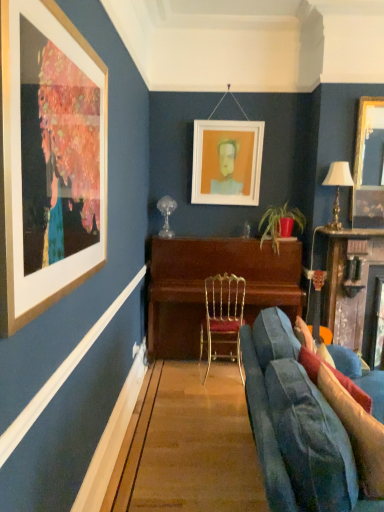
What is the approximate width of velvet blue couch at lower right?

velvet blue couch at lower right is 1.06 meters in width.

What is the approximate width of gold metallic chair at center?

16.53 inches.

Describe the element at coordinates (227, 162) in the screenshot. I see `matte white picture frame at center, the 2th picture frame from the front` at that location.

Find the location of a particular element. This screenshot has height=512, width=384. matte white picture frame at center, marked as the first picture frame in a left-to-right arrangement is located at coordinates (227, 162).

At what (x,y) coordinates should I click in order to perform the action: click on green leafy plant in red pot at center. Please return your answer as a coordinate pair (x, y). The height and width of the screenshot is (512, 384). Looking at the image, I should click on (279, 222).

The height and width of the screenshot is (512, 384). What are the coordinates of `velvet blue couch at lower right` in the screenshot? It's located at (x=295, y=426).

Is point (308, 369) farther from viewer compared to point (354, 438)?

That is True.

From their relative heights in the image, would you say velvet red pillow at lower right, which is the 1th pillow in back-to-front order, is taller or shorter than velvet blue pillow at lower right, the second pillow positioned from the back?

velvet red pillow at lower right, which is the 1th pillow in back-to-front order, is shorter than velvet blue pillow at lower right, the second pillow positioned from the back.

Who is bigger, velvet red pillow at lower right, which is the 1th pillow in back-to-front order, or velvet blue pillow at lower right, the second pillow positioned from the back?

Bigger between the two is velvet blue pillow at lower right, the second pillow positioned from the back.

Is velvet red pillow at lower right, which is the 1th pillow in back-to-front order, in front of velvet blue pillow at lower right, the second pillow positioned from the back?

No, it is not.

From the picture: From the image's perspective, which is above, wooden piano at center or velvet blue pillow at lower right, the second pillow positioned from the back?

From the image's view, wooden piano at center is above.

Does point (170, 275) come in front of point (360, 461)?

No, (170, 275) is behind (360, 461).

Which object is wider, wooden piano at center or velvet blue pillow at lower right, which is counted as the 1th pillow, starting from the front?

Wider between the two is wooden piano at center.

Which of these two, green leafy plant in red pot at center or velvet blue pillow at lower right, the second pillow positioned from the back, is thinner?

velvet blue pillow at lower right, the second pillow positioned from the back.

Is green leafy plant in red pot at center to the right of velvet blue pillow at lower right, which is counted as the 1th pillow, starting from the front, from the viewer's perspective?

Yes.

Which object is more forward, green leafy plant in red pot at center or velvet blue pillow at lower right, which is counted as the 1th pillow, starting from the front?

velvet blue pillow at lower right, which is counted as the 1th pillow, starting from the front, is more forward.

From a real-world perspective, between green leafy plant in red pot at center and velvet blue pillow at lower right, which is counted as the 1th pillow, starting from the front, who is vertically higher?

green leafy plant in red pot at center is physically above.

Based on the photo, from a real-world perspective, is wooden piano at center positioned above or below matte white picture frame at center, marked as the first picture frame in a left-to-right arrangement?

Clearly, from a real-world perspective, wooden piano at center is below matte white picture frame at center, marked as the first picture frame in a left-to-right arrangement.

In terms of size, does wooden piano at center appear bigger or smaller than matte white picture frame at center, the 2th picture frame in the right-to-left sequence?

Clearly, wooden piano at center is larger in size than matte white picture frame at center, the 2th picture frame in the right-to-left sequence.

Looking at this image, from the image's perspective, is wooden piano at center above or below matte white picture frame at center, marked as the first picture frame in a left-to-right arrangement?

wooden piano at center is below matte white picture frame at center, marked as the first picture frame in a left-to-right arrangement.

Between velvet blue pillow at lower right, the second pillow positioned from the back, and wooden piano at center, which one appears on the left side from the viewer's perspective?

wooden piano at center.

Would you say velvet blue pillow at lower right, the second pillow positioned from the back, is outside wooden piano at center?

Yes.

Could you tell me if velvet blue pillow at lower right, the second pillow positioned from the back, is turned towards wooden piano at center?

No.

Is velvet red pillow at lower right, the second pillow viewed from the front, wider or thinner than wooden table at right?

Clearly, velvet red pillow at lower right, the second pillow viewed from the front, has less width compared to wooden table at right.

Is velvet red pillow at lower right, the second pillow viewed from the front, oriented away from wooden table at right?

No, velvet red pillow at lower right, the second pillow viewed from the front, is not facing away from wooden table at right.

Does point (341, 384) come behind point (362, 251)?

No.

Considering the sizes of velvet red pillow at lower right, which is the 1th pillow in back-to-front order, and wooden table at right in the image, is velvet red pillow at lower right, which is the 1th pillow in back-to-front order, bigger or smaller than wooden table at right?

In the image, velvet red pillow at lower right, which is the 1th pillow in back-to-front order, appears to be smaller than wooden table at right.

Is wooden table at right looking in the opposite direction of velvet blue pillow at lower right, which is counted as the 1th pillow, starting from the front?

No, velvet blue pillow at lower right, which is counted as the 1th pillow, starting from the front, is not at the back of wooden table at right.

From the wooden table at right, count the 2nd pillow to the left and point to it. Please provide its 2D coordinates.

[(357, 432)]

Is wooden table at right positioned beyond the bounds of velvet blue pillow at lower right, which is counted as the 1th pillow, starting from the front?

That's correct, wooden table at right is outside of velvet blue pillow at lower right, which is counted as the 1th pillow, starting from the front.

Is point (349, 257) positioned in front of point (323, 379)?

No, it is behind (323, 379).

Where is `pillow that is on the right side of velvet blue pillow at lower right, the second pillow positioned from the back`? This screenshot has width=384, height=512. pillow that is on the right side of velvet blue pillow at lower right, the second pillow positioned from the back is located at coordinates (335, 377).

From the wooden piano at center, count 2nd pillows forward and point to it. Please provide its 2D coordinates.

[(357, 432)]

Estimate the real-world distances between objects in this image. Which object is closer to wooden piano at center, gold metallic chair at center or wooden table at right?

The object closer to wooden piano at center is gold metallic chair at center.

From the image, which object appears to be farther from gold-framed mirror at upper right, placed as the 1th picture frame when sorted from right to left, velvet blue pillow at lower right, the second pillow positioned from the back, or velvet red pillow at lower right, which is the 1th pillow in back-to-front order?

Among the two, velvet blue pillow at lower right, the second pillow positioned from the back, is located further to gold-framed mirror at upper right, placed as the 1th picture frame when sorted from right to left.

Which object lies nearer to the anchor point gold metallic table lamp at right, wooden piano at center or wooden table at right?

The object closer to gold metallic table lamp at right is wooden table at right.

Considering their positions, is velvet blue couch at lower right positioned closer to gold-framed mirror at upper right, placed as the 1th picture frame when sorted from right to left, than wooden table at right?

Based on the image, wooden table at right appears to be nearer to gold-framed mirror at upper right, placed as the 1th picture frame when sorted from right to left.

Which object lies nearer to the anchor point wooden piano at center, gold-framed mirror at upper right, placed as the 1th picture frame when sorted from right to left, or gold metallic table lamp at right?

gold metallic table lamp at right.

Based on their spatial positions, is velvet red pillow at lower right, the second pillow viewed from the front, or velvet blue pillow at lower right, the second pillow positioned from the back, closer to gold metallic table lamp at right?

Among the two, velvet red pillow at lower right, the second pillow viewed from the front, is located nearer to gold metallic table lamp at right.

Based on their spatial positions, is velvet blue pillow at lower right, the second pillow positioned from the back, or gold metallic table lamp at right further from wooden table at right?

velvet blue pillow at lower right, the second pillow positioned from the back, is further to wooden table at right.

When comparing their distances from matte white picture frame at center, which is counted as the 1th picture frame, starting from the back, does gold metallic table lamp at right or velvet blue pillow at lower right, the second pillow positioned from the back, seem closer?

gold metallic table lamp at right.

Where is `picture frame positioned between velvet red pillow at lower right, the second pillow viewed from the front, and matte white picture frame at center, the 2th picture frame from the front, from near to far`? Image resolution: width=384 pixels, height=512 pixels. picture frame positioned between velvet red pillow at lower right, the second pillow viewed from the front, and matte white picture frame at center, the 2th picture frame from the front, from near to far is located at coordinates (369, 165).

This screenshot has height=512, width=384. In order to click on lamp between velvet red pillow at lower right, the second pillow viewed from the front, and gold-framed mirror at upper right, the 1th picture frame positioned from the front, from front to back in this screenshot , I will do `click(337, 188)`.

Image resolution: width=384 pixels, height=512 pixels. What are the coordinates of `chair between velvet blue couch at lower right and green leafy plant in red pot at center in the front-back direction` in the screenshot? It's located at (223, 317).

Where is `lamp that lies between gold-framed mirror at upper right, which is counted as the second picture frame, starting from the left, and wooden table at right from top to bottom`? The image size is (384, 512). lamp that lies between gold-framed mirror at upper right, which is counted as the second picture frame, starting from the left, and wooden table at right from top to bottom is located at coordinates (337, 188).